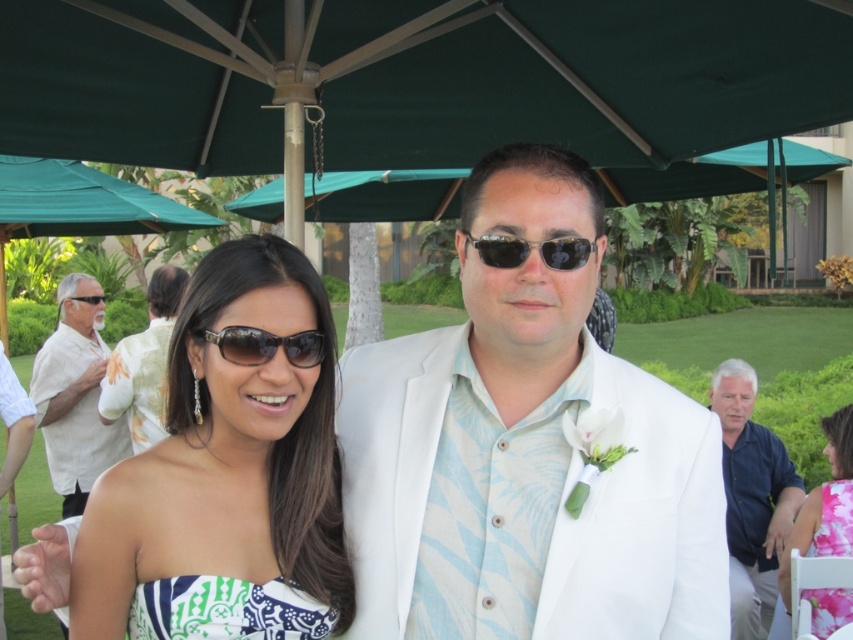
How distant is pink floral dress at lower right from pink floral fabric dress at lower right?

pink floral dress at lower right is 6.39 centimeters from pink floral fabric dress at lower right.

Can you confirm if pink floral dress at lower right is smaller than pink floral fabric dress at lower right?

No, pink floral dress at lower right is not smaller than pink floral fabric dress at lower right.

Which is behind, point (840, 436) or point (837, 556)?

Positioned behind is point (840, 436).

You are a GUI agent. You are given a task and a screenshot of the screen. Output one action in this format:
    pyautogui.click(x=<x>, y=<y>)
    Task: Click on the pink floral dress at lower right
    Image resolution: width=853 pixels, height=640 pixels.
    Given the screenshot: What is the action you would take?
    pyautogui.click(x=825, y=502)

Who is positioned more to the right, blue and white patterned fabric dress at center or black plastic sunglasses at center?

black plastic sunglasses at center

From the picture: Can you confirm if blue and white patterned fabric dress at center is shorter than black plastic sunglasses at center?

Incorrect, blue and white patterned fabric dress at center's height does not fall short of black plastic sunglasses at center's.

Is point (268, 634) closer to camera compared to point (511, 262)?

No.

Where is `blue and white patterned fabric dress at center`? blue and white patterned fabric dress at center is located at coordinates (225, 611).

Between white linen shirt at left and blue and white patterned fabric dress at center, which one appears on the left side from the viewer's perspective?

From the viewer's perspective, white linen shirt at left appears more on the left side.

Is point (97, 380) less distant than point (202, 616)?

No, (97, 380) is behind (202, 616).

This screenshot has height=640, width=853. I want to click on white linen shirt at left, so click(x=74, y=396).